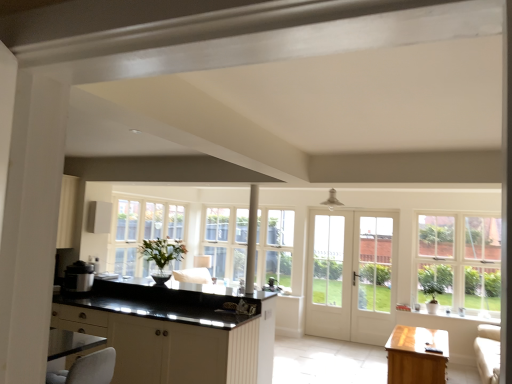
Describe the element at coordinates (461, 263) in the screenshot. I see `clear glass window at right` at that location.

What is the approximate width of white glass door at center, which is counted as the second screen door, starting from the right?

white glass door at center, which is counted as the second screen door, starting from the right, is 4.14 centimeters wide.

What do you see at coordinates (78, 277) in the screenshot?
I see `matte black rice cooker at left` at bounding box center [78, 277].

What is the approximate width of white glass door at center, the 2th screen door positioned from the left?

8.32 centimeters.

What is the approximate width of light brown wooden table at lower right?

light brown wooden table at lower right is 62.96 centimeters in width.

What is the approximate height of light brown wooden table at lower right?

It is 21.24 inches.

The height and width of the screenshot is (384, 512). Find the location of `clear glass window at right`. clear glass window at right is located at coordinates (461, 263).

Do you think matte black rice cooker at left is within white glass door at center, or outside of it?

matte black rice cooker at left is not enclosed by white glass door at center.

From a real-world perspective, is matte black rice cooker at left over white glass door at center?

Indeed, from a real-world perspective, matte black rice cooker at left stands above white glass door at center.

From the image's perspective, between matte black rice cooker at left and white glass door at center, which one is located above?

matte black rice cooker at left, from the image's perspective.

Can you confirm if matte black rice cooker at left is positioned to the left of white glass door at center?

Yes, matte black rice cooker at left is to the left of white glass door at center.

Considering the relative positions of white glass door at center, which is counted as the second screen door, starting from the right, and matte black rice cooker at left in the image provided, is white glass door at center, which is counted as the second screen door, starting from the right, to the right of matte black rice cooker at left from the viewer's perspective?

Yes.

Could you tell me if white glass door at center, which is counted as the second screen door, starting from the right, is facing matte black rice cooker at left?

No, white glass door at center, which is counted as the second screen door, starting from the right, does not turn towards matte black rice cooker at left.

At what (x,y) coordinates should I click in order to perform the action: click on the 1st screen door to the right of the matte black rice cooker at left, counting from the anchor's position. Please return your answer as a coordinate pair (x, y). Looking at the image, I should click on (329, 275).

Between point (318, 331) and point (81, 272), which one is positioned behind?

The point (318, 331) is more distant.

Which is correct: white glass door at center is inside clear glass window at right, or outside of it?

white glass door at center is outside clear glass window at right.

Considering the sizes of white glass door at center and clear glass window at right in the image, is white glass door at center taller or shorter than clear glass window at right?

Clearly, white glass door at center is taller compared to clear glass window at right.

Considering the sizes of white glass door at center and clear glass window at right in the image, is white glass door at center wider or thinner than clear glass window at right?

Considering their sizes, white glass door at center looks slimmer than clear glass window at right.

You are a GUI agent. You are given a task and a screenshot of the screen. Output one action in this format:
    pyautogui.click(x=<x>, y=<y>)
    Task: Click on the window that appears in front of the white glass door at center
    
    Given the screenshot: What is the action you would take?
    pyautogui.click(x=461, y=263)

From a real-world perspective, is white glass door at center, the 2th screen door positioned from the left, positioned over light brown wooden table at lower right based on gravity?

Yes, from a real-world perspective, white glass door at center, the 2th screen door positioned from the left, is above light brown wooden table at lower right.

Is point (386, 275) farther from viewer compared to point (397, 338)?

Yes, point (386, 275) is farther from viewer.

Based on the photo, considering the relative sizes of white glass door at center, which is counted as the first screen door, starting from the right, and light brown wooden table at lower right in the image provided, is white glass door at center, which is counted as the first screen door, starting from the right, thinner than light brown wooden table at lower right?

Correct, the width of white glass door at center, which is counted as the first screen door, starting from the right, is less than that of light brown wooden table at lower right.

Between white glass door at center, which is counted as the first screen door, starting from the right, and light brown wooden table at lower right, which one has smaller size?

With smaller size is white glass door at center, which is counted as the first screen door, starting from the right.

Which is nearer, (496, 278) or (353, 284)?

→ The point (496, 278) is in front.

Would you say clear glass window at right is a long distance from white glass door at center, which is counted as the first screen door, starting from the right?

They are positioned close to each other.

Is clear glass window at right oriented away from white glass door at center, which is counted as the first screen door, starting from the right?

clear glass window at right does not have its back to white glass door at center, which is counted as the first screen door, starting from the right.

Which of these two, clear glass window at right or white glass door at center, which is counted as the first screen door, starting from the right, stands taller?

With more height is white glass door at center, which is counted as the first screen door, starting from the right.

From a real-world perspective, is light brown wooden table at lower right positioned above or below clear glass window at right?

In terms of real-world spatial position, light brown wooden table at lower right is below clear glass window at right.

Which object is closer to the camera, light brown wooden table at lower right or clear glass window at right?

light brown wooden table at lower right is closer to the camera.

Is light brown wooden table at lower right far away from clear glass window at right?

Yes.

Considering the sizes of objects white glass door at center and matte black rice cooker at left in the image provided, who is smaller, white glass door at center or matte black rice cooker at left?

With smaller size is matte black rice cooker at left.

Which object is further away from the camera taking this photo, white glass door at center or matte black rice cooker at left?

white glass door at center is further away from the camera.

How many degrees apart are the facing directions of white glass door at center and matte black rice cooker at left?

The angular difference between white glass door at center and matte black rice cooker at left is 2.09 degrees.

Considering the positions of point (365, 307) and point (69, 265), is point (365, 307) closer or farther from the camera than point (69, 265)?

Point (365, 307) is farther from the camera than point (69, 265).

Locate an element on the screen. appliance located above the white glass door at center (from a real-world perspective) is located at coordinates (78, 277).

From the matte black rice cooker at left, count 1st screen door to the right and point to it. Please provide its 2D coordinates.

[(329, 275)]

Estimate the real-world distances between objects in this image. Which object is further from light brown wooden table at lower right, clear glass window at right or white glass door at center?

white glass door at center lies further to light brown wooden table at lower right than the other object.

Looking at the image, which one is located closer to matte black rice cooker at left, clear glass window at right or white glass door at center, placed as the first screen door when sorted from left to right?

Based on the image, white glass door at center, placed as the first screen door when sorted from left to right, appears to be nearer to matte black rice cooker at left.

Based on their spatial positions, is light brown wooden table at lower right or white glass door at center closer to clear glass window at right?

The object closer to clear glass window at right is white glass door at center.

When comparing their distances from white glass door at center, the 2th screen door positioned from the left, does white glass door at center, placed as the first screen door when sorted from left to right, or white glass door at center seem closer?

white glass door at center is positioned closer to the anchor white glass door at center, the 2th screen door positioned from the left.

Estimate the real-world distances between objects in this image. Which object is closer to white glass door at center, which is counted as the second screen door, starting from the right, white glass door at center or clear glass window at right?

The object closer to white glass door at center, which is counted as the second screen door, starting from the right, is white glass door at center.

From the image, which object appears to be nearer to white glass door at center, placed as the first screen door when sorted from left to right, clear glass window at right or white glass door at center?

white glass door at center is positioned closer to the anchor white glass door at center, placed as the first screen door when sorted from left to right.

Based on the photo, when comparing their distances from white glass door at center, which is counted as the second screen door, starting from the right, does white glass door at center or white glass door at center, the 2th screen door positioned from the left, seem closer?

white glass door at center is positioned closer to the anchor white glass door at center, which is counted as the second screen door, starting from the right.

Which object lies nearer to the anchor point matte black rice cooker at left, light brown wooden table at lower right or white glass door at center, which is counted as the first screen door, starting from the right?

light brown wooden table at lower right lies closer to matte black rice cooker at left than the other object.

Where is `screen door between light brown wooden table at lower right and white glass door at center along the z-axis`? The image size is (512, 384). screen door between light brown wooden table at lower right and white glass door at center along the z-axis is located at coordinates (373, 277).

Where is `door between white glass door at center, placed as the first screen door when sorted from left to right, and white glass door at center, which is counted as the first screen door, starting from the right, in the horizontal direction`? door between white glass door at center, placed as the first screen door when sorted from left to right, and white glass door at center, which is counted as the first screen door, starting from the right, in the horizontal direction is located at coordinates (351, 275).

Where is `window positioned between light brown wooden table at lower right and white glass door at center, which is counted as the second screen door, starting from the right, from near to far`? The width and height of the screenshot is (512, 384). window positioned between light brown wooden table at lower right and white glass door at center, which is counted as the second screen door, starting from the right, from near to far is located at coordinates (461, 263).

Locate an element on the screen. The height and width of the screenshot is (384, 512). screen door between matte black rice cooker at left and white glass door at center, which is counted as the first screen door, starting from the right is located at coordinates (329, 275).